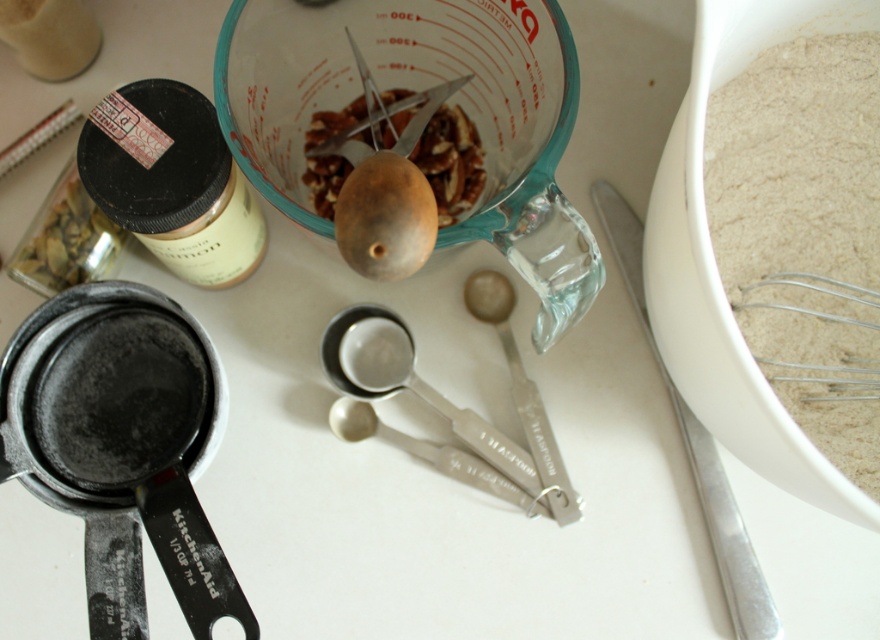
Question: Which object appears farthest from the camera in this image?

Choices:
 (A) white powdery flour at right
 (B) silver metallic knife at lower right
 (C) silver metallic measuring spoon at center

Answer: (C)

Question: Estimate the real-world distances between objects in this image. Which object is closer to the wooden spoon at center?

Choices:
 (A) brown matte nuts at center
 (B) white powdery flour at right

Answer: (A)

Question: Does white powdery flour at right have a larger size compared to brown matte nuts at center?

Choices:
 (A) yes
 (B) no

Answer: (A)

Question: Is white powdery flour at right to the left of silver metallic knife at lower right from the viewer's perspective?

Choices:
 (A) yes
 (B) no

Answer: (B)

Question: Which object appears farthest from the camera in this image?

Choices:
 (A) silver metallic measuring spoon at center
 (B) wooden spoon at center
 (C) silver metallic knife at lower right
 (D) brown matte nuts at center

Answer: (A)

Question: Is white powdery flour at right below silver metallic knife at lower right?

Choices:
 (A) no
 (B) yes

Answer: (A)